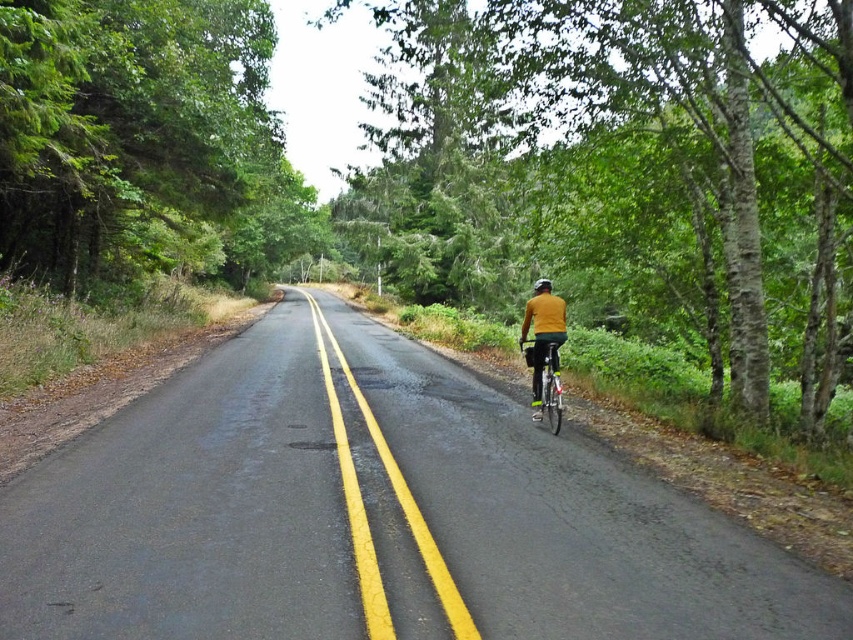
Question: Which point appears farthest from the camera in this image?

Choices:
 (A) (540, 276)
 (B) (85, 214)

Answer: (A)

Question: Where is green leafy tree at center located in relation to green leafy tree at left in the image?

Choices:
 (A) below
 (B) above

Answer: (B)

Question: Which of these objects is positioned closest to the yellow matte shirt at center?

Choices:
 (A) green leafy tree at center
 (B) green leafy tree at left
 (C) black matte helmet at upper center

Answer: (C)

Question: Can you confirm if green leafy tree at center is positioned above green leafy tree at left?

Choices:
 (A) no
 (B) yes

Answer: (B)

Question: Can you confirm if green leafy tree at center is positioned below black matte helmet at upper center?

Choices:
 (A) no
 (B) yes

Answer: (A)

Question: Which point is farther from the camera taking this photo?

Choices:
 (A) [809, 99]
 (B) [544, 282]
 (C) [250, 131]
 (D) [550, 360]

Answer: (C)